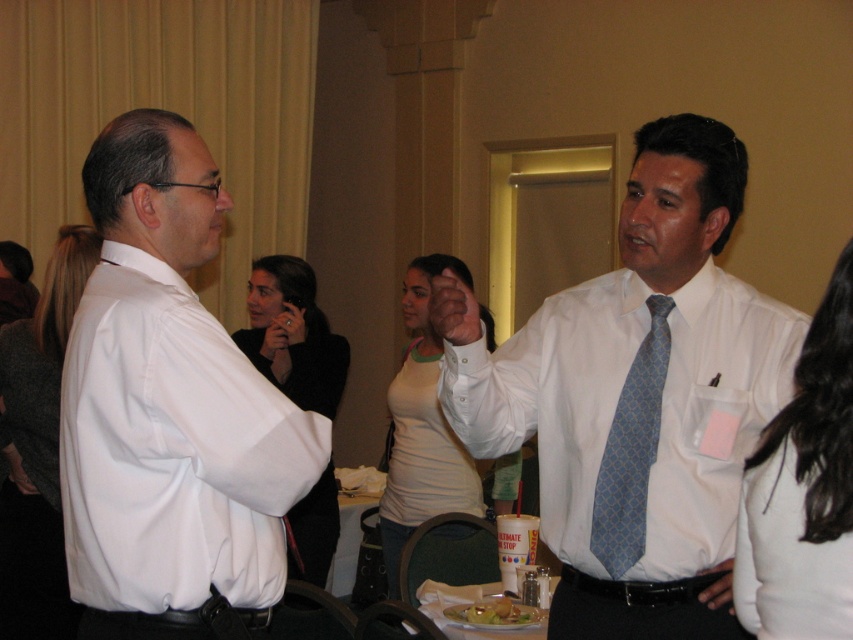
You are a photographer at a formal event. You need to capture a photo of the two people in the center of the image. The first person is wearing a white shirt with blue tie at center, and the second is wearing a white matte tank top at center. Based on their positions, which one is standing higher up?

The white shirt with blue tie at center is located above the white matte tank top at center, so the person wearing the white shirt with blue tie at center is standing higher up.

You are at a social event and want to approach the dark gray sweater at center. There is a white fabric shirt at right blocking your path. Can you walk around them to the left?

Yes, you can walk around the white fabric shirt at right to the left since the white fabric shirt at right is to the right of dark gray sweater at center, meaning the dark gray sweater at center is to the left of the white fabric shirt at right, allowing you to go around that side.